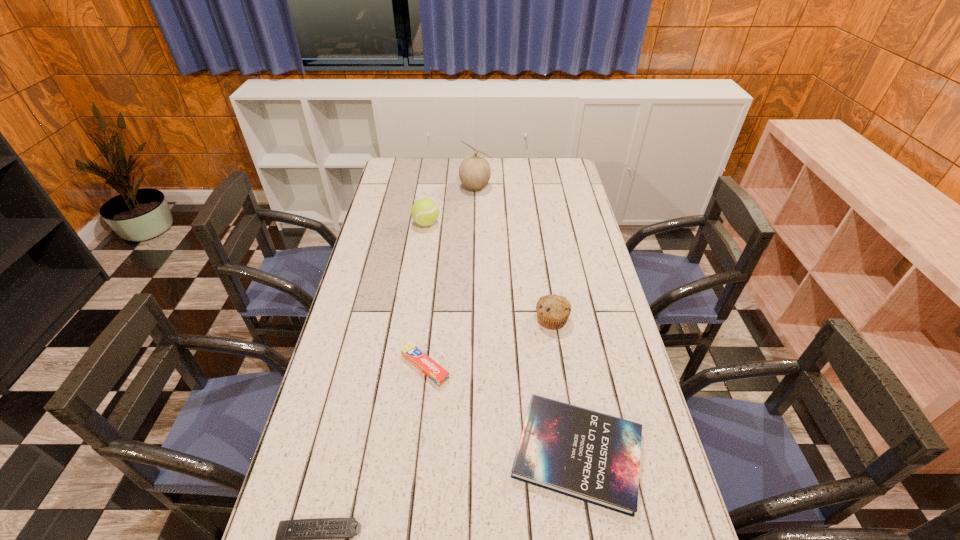
Where is `vacant area that lies between the muffin and the fourth farthest object`? The width and height of the screenshot is (960, 540). vacant area that lies between the muffin and the fourth farthest object is located at coordinates (489, 343).

Find the location of a particular element. The image size is (960, 540). vacant area that lies between the second nearest object and the toothpaste is located at coordinates (501, 410).

Image resolution: width=960 pixels, height=540 pixels. What are the coordinates of `free spot between the fourth shortest object and the cantaloup` in the screenshot? It's located at (514, 253).

You are a GUI agent. You are given a task and a screenshot of the screen. Output one action in this format:
    pyautogui.click(x=<x>, y=<y>)
    Task: Click on the unoccupied position between the cantaloup and the third farthest object
    The height and width of the screenshot is (540, 960).
    Given the screenshot: What is the action you would take?
    pyautogui.click(x=514, y=253)

Find the location of a particular element. unoccupied position between the hardback book and the muffin is located at coordinates (564, 386).

Locate an element on the screen. The height and width of the screenshot is (540, 960). free space between the tallest object and the second nearest object is located at coordinates (527, 320).

You are a GUI agent. You are given a task and a screenshot of the screen. Output one action in this format:
    pyautogui.click(x=<x>, y=<y>)
    Task: Click on the vacant region between the third nearest object and the fifth farthest object
    The image size is (960, 540).
    Given the screenshot: What is the action you would take?
    pyautogui.click(x=501, y=410)

Where is `object that is the closest to the tallest object`? This screenshot has width=960, height=540. object that is the closest to the tallest object is located at coordinates click(x=425, y=212).

Locate an element on the screen. object that is the fourth closest to the fourth farthest object is located at coordinates (425, 212).

This screenshot has height=540, width=960. Find the location of `free spot that satisfies the following two spatial constraints: 1. on the back side of the toothpaste; 2. on the right side of the third tallest object`. free spot that satisfies the following two spatial constraints: 1. on the back side of the toothpaste; 2. on the right side of the third tallest object is located at coordinates (430, 319).